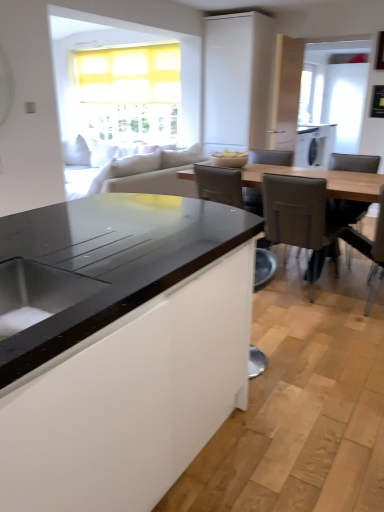
Describe the element at coordinates (225, 188) in the screenshot. This screenshot has width=384, height=512. I see `leather-like gray armchair at center` at that location.

This screenshot has height=512, width=384. What do you see at coordinates (219, 185) in the screenshot?
I see `metallic gray chair at lower center, positioned as the 1th chair in left-to-right order` at bounding box center [219, 185].

Where is `brown leather chair at right, positioned as the 2th chair in right-to-left order`? This screenshot has height=512, width=384. brown leather chair at right, positioned as the 2th chair in right-to-left order is located at coordinates point(376,256).

Image resolution: width=384 pixels, height=512 pixels. What are the coordinates of `leather-like gray armchair at center` in the screenshot? It's located at (225, 188).

How far apart are leatherette chair at right, acting as the second chair starting from the left, and leatherette chair at right, the first chair from the right?

They are 3.48 feet apart.

Consider the image. Does leatherette chair at right, acting as the second chair starting from the left, turn towards leatherette chair at right, the fourth chair from the left?

Yes, leatherette chair at right, acting as the second chair starting from the left, is turned towards leatherette chair at right, the fourth chair from the left.

From the image's perspective, is leatherette chair at right, which ranks as the 3th chair in right-to-left order, positioned above or below leatherette chair at right, the fourth chair from the left?

leatherette chair at right, which ranks as the 3th chair in right-to-left order, is situated lower than leatherette chair at right, the fourth chair from the left, in the image.

Is leatherette chair at right, the first chair from the right, located within leatherette chair at right, which ranks as the 3th chair in right-to-left order?

Actually, leatherette chair at right, the first chair from the right, is outside leatherette chair at right, which ranks as the 3th chair in right-to-left order.

How different are the orientations of wooden table at center and leatherette chair at right, the fourth chair from the left, in degrees?

0.715 degrees separate the facing orientations of wooden table at center and leatherette chair at right, the fourth chair from the left.

Find the location of a particular element. The image size is (384, 512). kitchen & dining room table that appears below the leatherette chair at right, the fourth chair from the left (from a real-world perspective) is located at coordinates pyautogui.click(x=323, y=177).

Would you say wooden table at center is outside leatherette chair at right, the first chair from the right?

Yes.

Between metallic gray chair at lower center, which is the 4th chair in right-to-left order, and white matte cabinet at upper center, which one has less height?

metallic gray chair at lower center, which is the 4th chair in right-to-left order, is shorter.

How distant is metallic gray chair at lower center, which is the 4th chair in right-to-left order, from white matte cabinet at upper center?

metallic gray chair at lower center, which is the 4th chair in right-to-left order, is 7.83 feet away from white matte cabinet at upper center.

Which of these two, metallic gray chair at lower center, positioned as the 1th chair in left-to-right order, or white matte cabinet at upper center, is wider?

Wider between the two is white matte cabinet at upper center.

Find the location of a particular element. The height and width of the screenshot is (512, 384). cabinetry that appears behind the metallic gray chair at lower center, positioned as the 1th chair in left-to-right order is located at coordinates (237, 81).

Looking at their sizes, would you say leatherette chair at right, the first chair from the right, is wider or thinner than wooden table at center?

leatherette chair at right, the first chair from the right, is thinner than wooden table at center.

Does point (359, 205) come in front of point (249, 168)?

Yes, point (359, 205) is in front of point (249, 168).

Would you consider leatherette chair at right, the fourth chair from the left, to be distant from wooden table at center?

No, leatherette chair at right, the fourth chair from the left, is in close proximity to wooden table at center.

Identify the location of the 2nd chair positioned above the wooden table at center (from a real-world perspective). (346, 211).

Can you confirm if matte white bowl at center is bigger than white matte cabinet at upper center?

No.

Is matte white bowl at center in front of or behind white matte cabinet at upper center in the image?

Visually, matte white bowl at center is located in front of white matte cabinet at upper center.

Is matte white bowl at center turned away from white matte cabinet at upper center?

No, matte white bowl at center's orientation is not away from white matte cabinet at upper center.

From a real-world perspective, is matte white bowl at center below white matte cabinet at upper center?

Correct, in the physical world, matte white bowl at center is lower than white matte cabinet at upper center.

From the image's perspective, is leather-like gray armchair at center over leatherette chair at right, which ranks as the 3th chair in right-to-left order?

Yes, from the image's perspective, leather-like gray armchair at center is over leatherette chair at right, which ranks as the 3th chair in right-to-left order.

Considering the sizes of objects leather-like gray armchair at center and leatherette chair at right, acting as the second chair starting from the left, in the image provided, who is thinner, leather-like gray armchair at center or leatherette chair at right, acting as the second chair starting from the left,?

With smaller width is leather-like gray armchair at center.

Could you tell me if leather-like gray armchair at center is turned towards leatherette chair at right, which ranks as the 3th chair in right-to-left order?

No.

Considering the relative positions of leather-like gray armchair at center and leatherette chair at right, acting as the second chair starting from the left, in the image provided, is leather-like gray armchair at center behind leatherette chair at right, acting as the second chair starting from the left,?

Yes, it is.

Is leatherette chair at right, the first chair from the right, oriented away from leather-like gray armchair at center?

No, leatherette chair at right, the first chair from the right, is not facing away from leather-like gray armchair at center.

What's the angular difference between leatherette chair at right, the first chair from the right, and leather-like gray armchair at center's facing directions?

There is a 178-degree angle between the facing directions of leatherette chair at right, the first chair from the right, and leather-like gray armchair at center.

How much distance is there between leatherette chair at right, the first chair from the right, and leather-like gray armchair at center?

They are 1.06 meters apart.

Based on their sizes in the image, would you say leatherette chair at right, the fourth chair from the left, is bigger or smaller than leather-like gray armchair at center?

leatherette chair at right, the fourth chair from the left, is bigger than leather-like gray armchair at center.

The width and height of the screenshot is (384, 512). I want to click on the 1st chair directly beneath the leatherette chair at right, acting as the second chair starting from the left (from a real-world perspective), so click(x=346, y=211).

Where is `chair located behind the wooden table at center`? The height and width of the screenshot is (512, 384). chair located behind the wooden table at center is located at coordinates (346, 211).

Which object lies further to the anchor point wooden table at center, white matte cabinet at upper center or metallic gray chair at lower center, which is the 4th chair in right-to-left order?

Among the two, white matte cabinet at upper center is located further to wooden table at center.

Looking at the image, which one is located closer to brown leather chair at right, positioned as the 2th chair in right-to-left order, leather-like gray armchair at center or leatherette chair at right, the fourth chair from the left?

leatherette chair at right, the fourth chair from the left, is closer to brown leather chair at right, positioned as the 2th chair in right-to-left order.

From the image, which object appears to be nearer to leatherette chair at right, acting as the second chair starting from the left, brown leather chair at right, which is the third chair from left to right, or metallic gray chair at lower center, positioned as the 1th chair in left-to-right order?

metallic gray chair at lower center, positioned as the 1th chair in left-to-right order, is positioned closer to the anchor leatherette chair at right, acting as the second chair starting from the left.

When comparing their distances from wooden table at center, does white matte cabinet at upper center or leatherette chair at right, the first chair from the right, seem further?

The object further to wooden table at center is white matte cabinet at upper center.

Based on their spatial positions, is leather-like gray armchair at center or leatherette chair at right, acting as the second chair starting from the left, further from white matte cabinet at upper center?

The object further to white matte cabinet at upper center is leatherette chair at right, acting as the second chair starting from the left.

From the image, which object appears to be nearer to matte white bowl at center, leatherette chair at right, acting as the second chair starting from the left, or brown leather chair at right, positioned as the 2th chair in right-to-left order?

leatherette chair at right, acting as the second chair starting from the left.

From the image, which object appears to be farther from brown leather chair at right, which is the third chair from left to right, white matte cabinet at upper center or leather-like gray armchair at center?

white matte cabinet at upper center is positioned further to the anchor brown leather chair at right, which is the third chair from left to right.

Considering their positions, is leatherette chair at right, acting as the second chair starting from the left, positioned closer to metallic gray chair at lower center, which is the 4th chair in right-to-left order, than leatherette chair at right, the first chair from the right?

The object closer to metallic gray chair at lower center, which is the 4th chair in right-to-left order, is leatherette chair at right, acting as the second chair starting from the left.

Where is `chair between brown leather chair at right, positioned as the 2th chair in right-to-left order, and leatherette chair at right, the first chair from the right, along the z-axis`? The image size is (384, 512). chair between brown leather chair at right, positioned as the 2th chair in right-to-left order, and leatherette chair at right, the first chair from the right, along the z-axis is located at coordinates (298, 218).

I want to click on kitchen & dining room table positioned between leatherette chair at right, which ranks as the 3th chair in right-to-left order, and matte white bowl at center from near to far, so click(x=323, y=177).

Locate an element on the screen. The image size is (384, 512). armchair between leatherette chair at right, acting as the second chair starting from the left, and white matte cabinet at upper center, along the z-axis is located at coordinates (225, 188).

Locate an element on the screen. The width and height of the screenshot is (384, 512). armchair between leatherette chair at right, acting as the second chair starting from the left, and matte white bowl at center in the front-back direction is located at coordinates (225, 188).